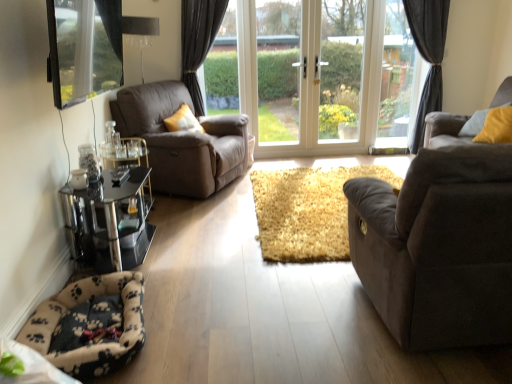
Question: Can you confirm if fluffy beige carpet at center, the 1th cat bed viewed from the top, is bigger than black glass table at lower left?

Choices:
 (A) no
 (B) yes

Answer: (A)

Question: From the image's perspective, would you say fluffy beige carpet at center, the 1th cat bed viewed from the top, is shown under black glass table at lower left?

Choices:
 (A) no
 (B) yes

Answer: (A)

Question: Is fluffy beige carpet at center, arranged as the 1th cat bed when viewed from the right, positioned beyond the bounds of black glass table at lower left?

Choices:
 (A) no
 (B) yes

Answer: (B)

Question: From a real-world perspective, is fluffy beige carpet at center, the 1th cat bed viewed from the top, positioned over black glass table at lower left based on gravity?

Choices:
 (A) yes
 (B) no

Answer: (B)

Question: From the image's perspective, does fluffy beige carpet at center, the 1th cat bed viewed from the top, appear higher than black glass table at lower left?

Choices:
 (A) no
 (B) yes

Answer: (B)

Question: Are fluffy beige carpet at center, which is the second cat bed in front-to-back order, and black glass table at lower left far apart?

Choices:
 (A) no
 (B) yes

Answer: (B)

Question: Is clear glass window at upper center, positioned as the 2th window frame in left-to-right order, thinner than dark gray fabric curtain at upper right?

Choices:
 (A) no
 (B) yes

Answer: (B)

Question: Considering the relative sizes of clear glass window at upper center, positioned as the 2th window frame in left-to-right order, and dark gray fabric curtain at upper right in the image provided, is clear glass window at upper center, positioned as the 2th window frame in left-to-right order, bigger than dark gray fabric curtain at upper right?

Choices:
 (A) no
 (B) yes

Answer: (A)

Question: Is clear glass window at upper center, positioned as the 2th window frame in left-to-right order, closer to camera compared to dark gray fabric curtain at upper right?

Choices:
 (A) yes
 (B) no

Answer: (B)

Question: From the image's perspective, is clear glass window at upper center, the 1th window frame in the right-to-left sequence, above dark gray fabric curtain at upper right?

Choices:
 (A) no
 (B) yes

Answer: (B)

Question: From a real-world perspective, does clear glass window at upper center, the 1th window frame in the right-to-left sequence, sit lower than dark gray fabric curtain at upper right?

Choices:
 (A) no
 (B) yes

Answer: (A)

Question: Is clear glass window at upper center, positioned as the 2th window frame in left-to-right order, turned away from dark gray fabric curtain at upper right?

Choices:
 (A) yes
 (B) no

Answer: (A)

Question: Does fluffy beige and black paw print cat bed at lower left, the first cat bed viewed from the left, have a smaller size compared to transparent glass window at upper left?

Choices:
 (A) no
 (B) yes

Answer: (B)